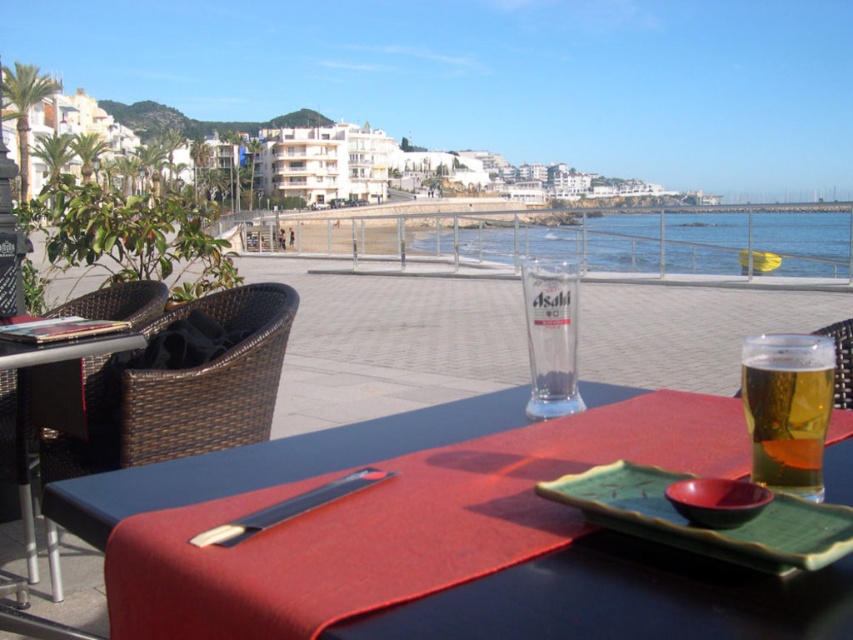
You are setting up for a small gathering and need to place a decorative item on the green textured tray at lower right and the woven rattan table at left. Considering their sizes, which object can accommodate a larger item?

The woven rattan table at left can accommodate a larger item since it has a bigger size compared to the green textured tray at lower right.